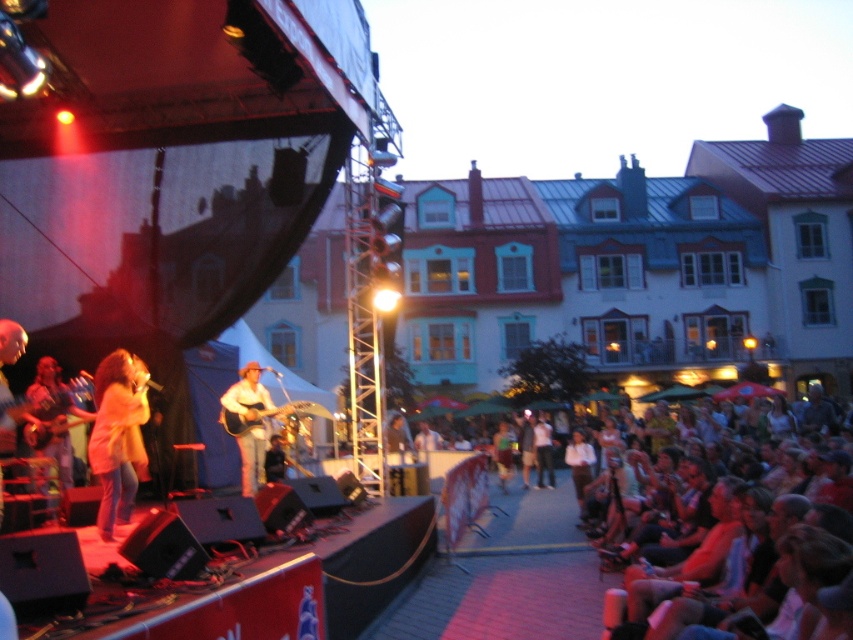
Question: Which point is farther to the camera?

Choices:
 (A) (602, 589)
 (B) (250, 428)

Answer: (B)

Question: Is light brown leather jacket at stage left positioned before light brown acoustic guitar at center stage?

Choices:
 (A) no
 (B) yes

Answer: (B)

Question: Which of these objects is positioned farthest from the light brown leather jacket at stage left?

Choices:
 (A) white cotton shirt at lower right
 (B) light brown acoustic guitar at center stage

Answer: (A)

Question: Is light brown leather jacket at stage left wider than light brown acoustic guitar at center stage?

Choices:
 (A) yes
 (B) no

Answer: (B)

Question: Is light brown leather jacket at stage left further to camera compared to light brown acoustic guitar at center stage?

Choices:
 (A) no
 (B) yes

Answer: (A)

Question: Among these points, which one is nearest to the camera?

Choices:
 (A) (753, 449)
 (B) (97, 531)
 (C) (235, 401)

Answer: (B)